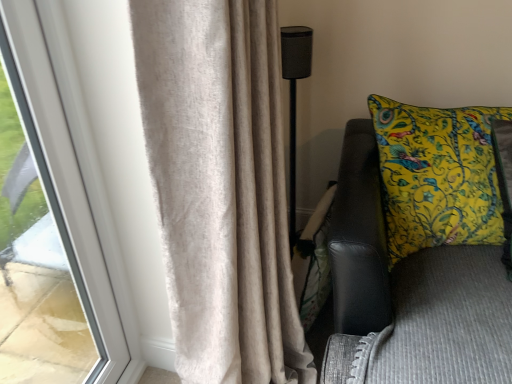
Question: Is beige textured curtain at left inside or outside of yellow printed cushion at right?

Choices:
 (A) inside
 (B) outside

Answer: (B)

Question: From the image's perspective, is beige textured curtain at left above or below yellow printed cushion at right?

Choices:
 (A) above
 (B) below

Answer: (B)

Question: Considering the real-world distances, which object is farthest from the black mesh speaker at center?

Choices:
 (A) beige textured curtain at left
 (B) yellow printed cushion at right

Answer: (A)

Question: Estimate the real-world distances between objects in this image. Which object is closer to the black mesh speaker at center?

Choices:
 (A) beige textured curtain at left
 (B) yellow printed cushion at right

Answer: (B)